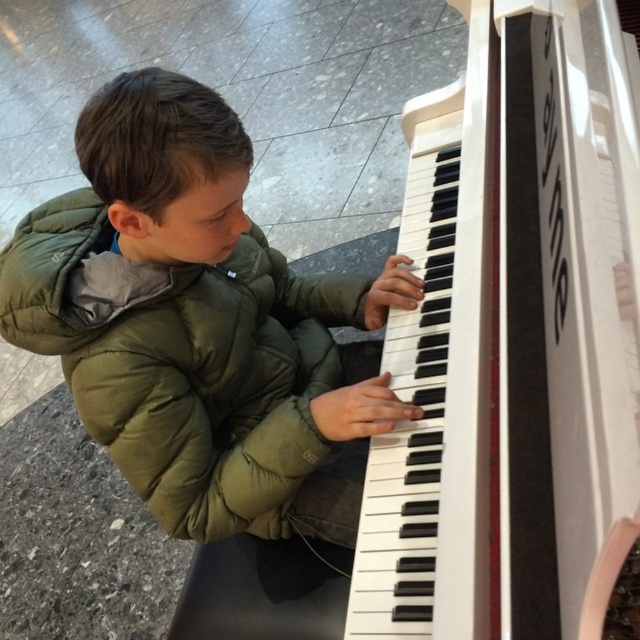
Question: Which object is farther from the camera taking this photo?

Choices:
 (A) white glossy piano at center
 (B) green puffy jacket at center

Answer: (B)

Question: Does white glossy piano at center have a greater width compared to green puffy jacket at center?

Choices:
 (A) yes
 (B) no

Answer: (B)

Question: Is white glossy piano at center smaller than green puffy jacket at center?

Choices:
 (A) yes
 (B) no

Answer: (B)

Question: Which point is closer to the camera?

Choices:
 (A) (236, 314)
 (B) (525, 224)

Answer: (B)

Question: Observing the image, what is the correct spatial positioning of white glossy piano at center in reference to green puffy jacket at center?

Choices:
 (A) below
 (B) above

Answer: (B)